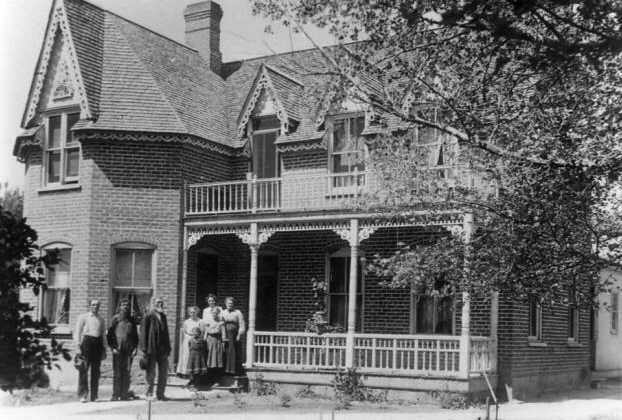
At what (x,y) coordinates should I click in order to perform the action: click on chimney. Please return your answer as a coordinate pair (x, y). The width and height of the screenshot is (622, 420). Looking at the image, I should click on (202, 25).